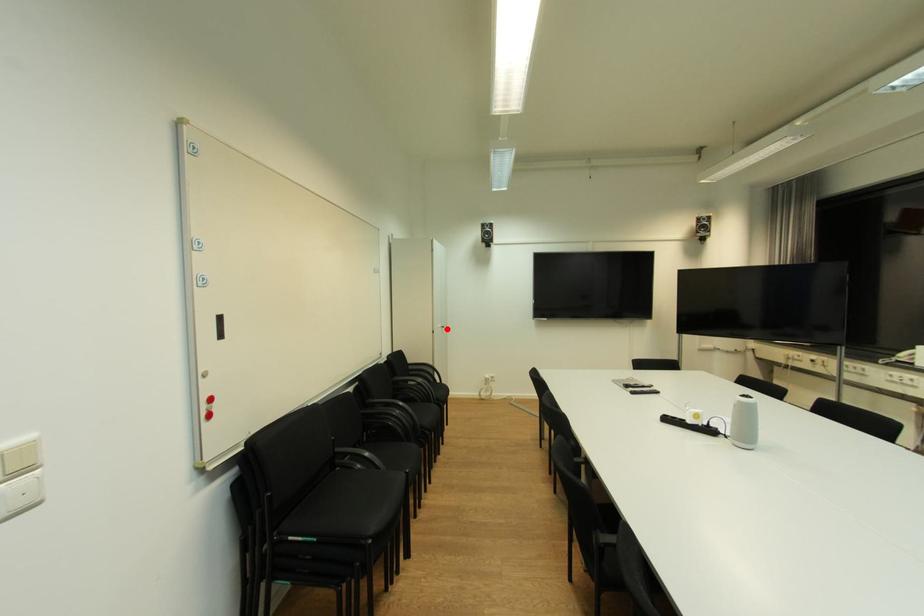
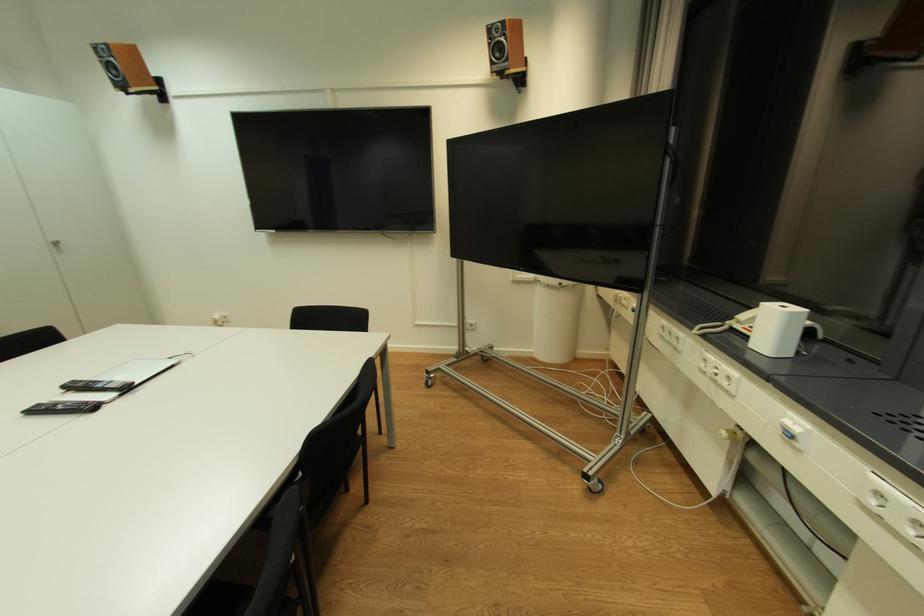
In the second image, find the point that corresponds to the highlighted location in the first image.

(57, 246)